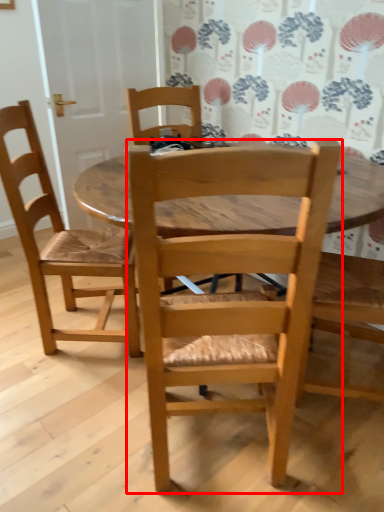
Question: From the image, what is the correct spatial relationship of chair (annotated by the red box) in relation to chair?

Choices:
 (A) left
 (B) right

Answer: (B)